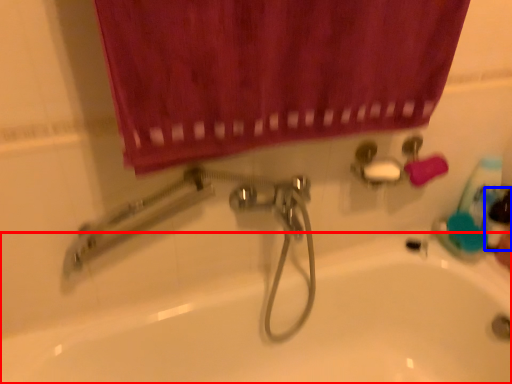
Question: Which of the following is the farthest to the observer, bath (highlighted by a red box) or mouthwash (highlighted by a blue box)?

Choices:
 (A) bath
 (B) mouthwash

Answer: (B)